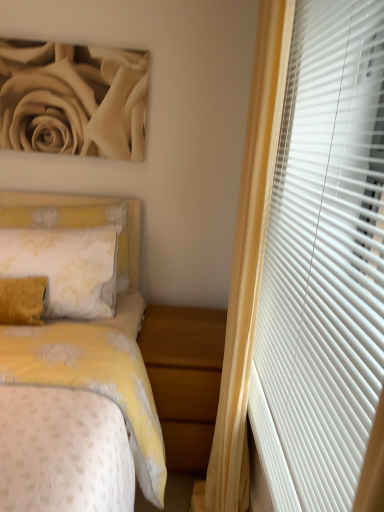
Question: From a real-world perspective, is white matte blinds at right positioned under wooden nightstand at lower center based on gravity?

Choices:
 (A) no
 (B) yes

Answer: (A)

Question: Does white matte blinds at right lie in front of wooden nightstand at lower center?

Choices:
 (A) yes
 (B) no

Answer: (A)

Question: Does white matte blinds at right lie behind wooden nightstand at lower center?

Choices:
 (A) yes
 (B) no

Answer: (B)

Question: Is there a large distance between white matte blinds at right and wooden nightstand at lower center?

Choices:
 (A) no
 (B) yes

Answer: (A)

Question: Would you say white matte blinds at right is outside wooden nightstand at lower center?

Choices:
 (A) yes
 (B) no

Answer: (A)

Question: Is yellow fabric headboard at left in front of or behind wooden nightstand at lower center in the image?

Choices:
 (A) behind
 (B) front

Answer: (A)

Question: From a real-world perspective, is yellow fabric headboard at left above or below wooden nightstand at lower center?

Choices:
 (A) above
 (B) below

Answer: (A)

Question: Is yellow fabric headboard at left wider or thinner than wooden nightstand at lower center?

Choices:
 (A) wide
 (B) thin

Answer: (B)

Question: Is yellow fabric headboard at left spatially inside wooden nightstand at lower center, or outside of it?

Choices:
 (A) outside
 (B) inside

Answer: (A)

Question: From the image's perspective, is white matte blinds at right above or below wooden nightstand at lower center?

Choices:
 (A) above
 (B) below

Answer: (A)

Question: From their relative heights in the image, would you say white matte blinds at right is taller or shorter than wooden nightstand at lower center?

Choices:
 (A) short
 (B) tall

Answer: (B)

Question: From a real-world perspective, is white matte blinds at right physically located above or below wooden nightstand at lower center?

Choices:
 (A) below
 (B) above

Answer: (B)

Question: Is white matte blinds at right in front of or behind wooden nightstand at lower center in the image?

Choices:
 (A) behind
 (B) front

Answer: (B)

Question: Considering the positions of point coord(134,215) and point coord(342,453), is point coord(134,215) closer or farther from the camera than point coord(342,453)?

Choices:
 (A) closer
 (B) farther

Answer: (B)

Question: Looking at the image, does yellow fabric headboard at left seem bigger or smaller compared to white matte blinds at right?

Choices:
 (A) big
 (B) small

Answer: (B)